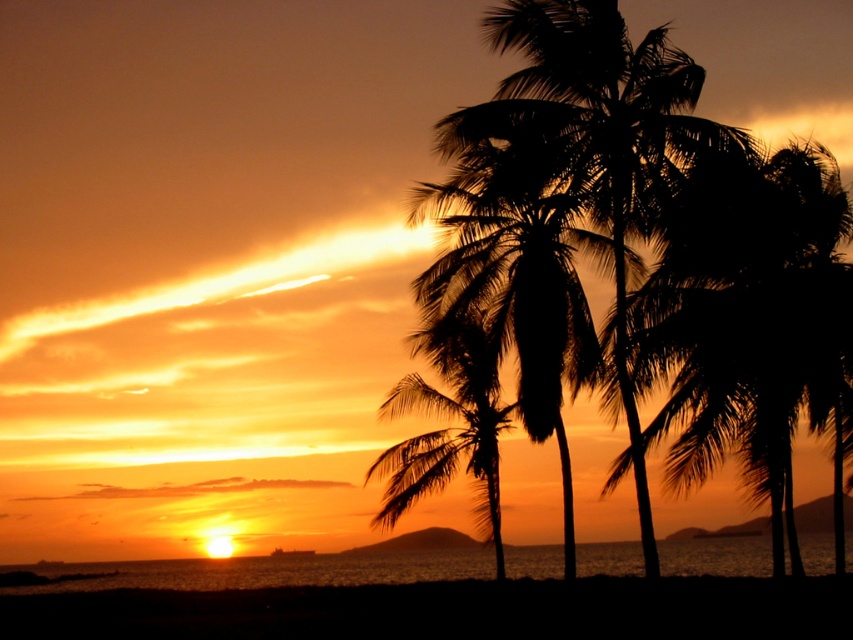
From the picture: You are standing on the beach and want to take a photo of the silhouette palm trees at right. If you are currently 10 meters away from them, how much closer do you need to move to ensure they fill your camera frame properly?

The silhouette palm trees at right are 24.31 meters apart. To fill the camera frame properly, you need to move closer by approximately 14.31 meters so that the distance becomes 10 meters minus 14.31 meters? Wait, that doesn

You are standing at the beach watching the sunset. You notice two points in the sky marked as point (x=788, y=488) and point (x=735, y=552). Which point is closer to you?

Point (x=788, y=488) is closer to the camera than point (x=735, y=552).